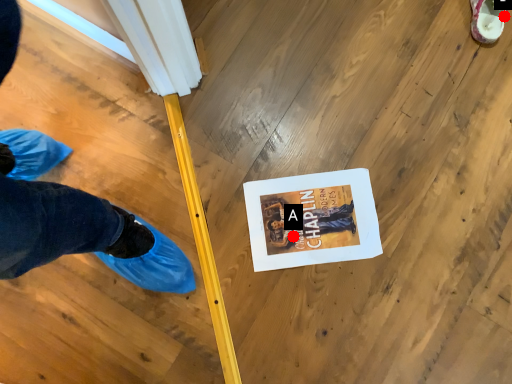
Question: Two points are circled on the image, labeled by A and B beside each circle. Which of the following is the closest to the observer?

Choices:
 (A) A is closer
 (B) B is closer

Answer: (A)